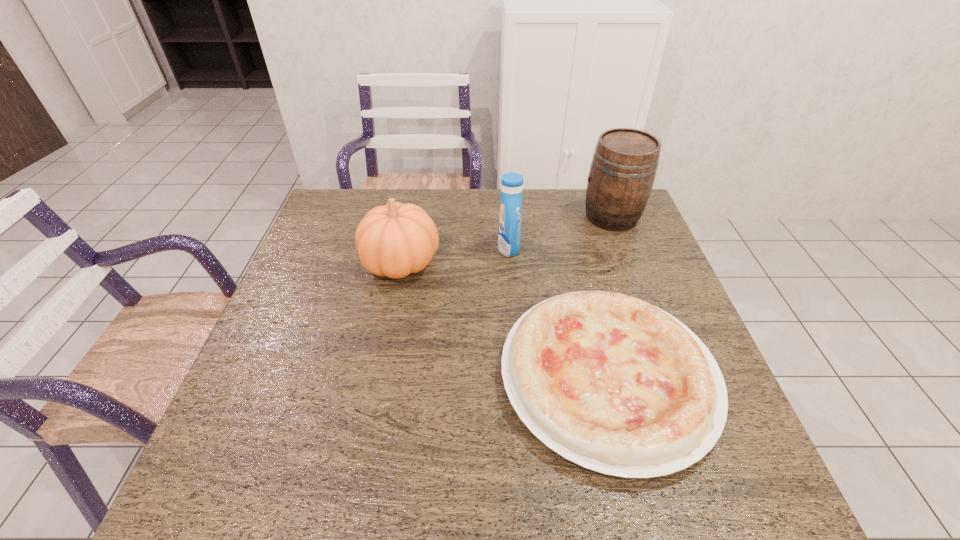
Image resolution: width=960 pixels, height=540 pixels. I want to click on vacant region located 0.120m on the front-facing side of the detergent, so click(457, 248).

I want to click on vacant space located 0.130m on the right of the leftmost object, so click(486, 262).

Locate an element on the screen. Image resolution: width=960 pixels, height=540 pixels. free space located on the back of the shortest object is located at coordinates 567,213.

This screenshot has width=960, height=540. Identify the location of object located at the far edge. (624, 165).

Where is `object at the near edge`? The height and width of the screenshot is (540, 960). object at the near edge is located at coordinates (608, 381).

At what (x,y) coordinates should I click in order to perform the action: click on cider that is positioned at the right edge. Please return your answer as a coordinate pair (x, y). This screenshot has width=960, height=540. Looking at the image, I should click on (624, 165).

At what (x,y) coordinates should I click in order to perform the action: click on pizza that is at the right edge. Please return your answer as a coordinate pair (x, y). This screenshot has width=960, height=540. Looking at the image, I should click on (608, 381).

Find the location of a particular element. This screenshot has width=960, height=540. object located in the far right corner section of the desktop is located at coordinates (624, 165).

Where is `object located at the near right corner`? object located at the near right corner is located at coordinates 608,381.

This screenshot has height=540, width=960. In the image, there is a desktop. Find the location of `free space at the far edge`. free space at the far edge is located at coordinates (472, 191).